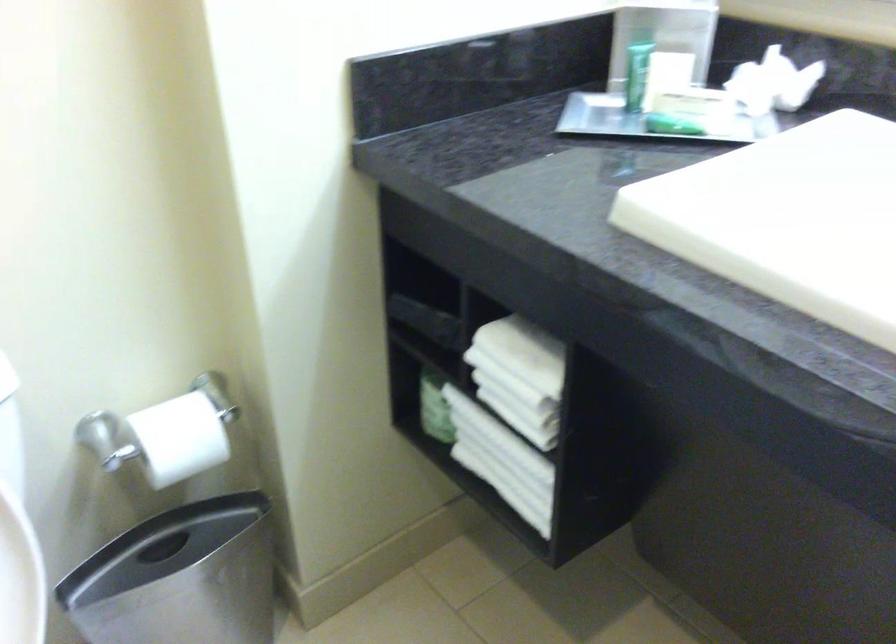
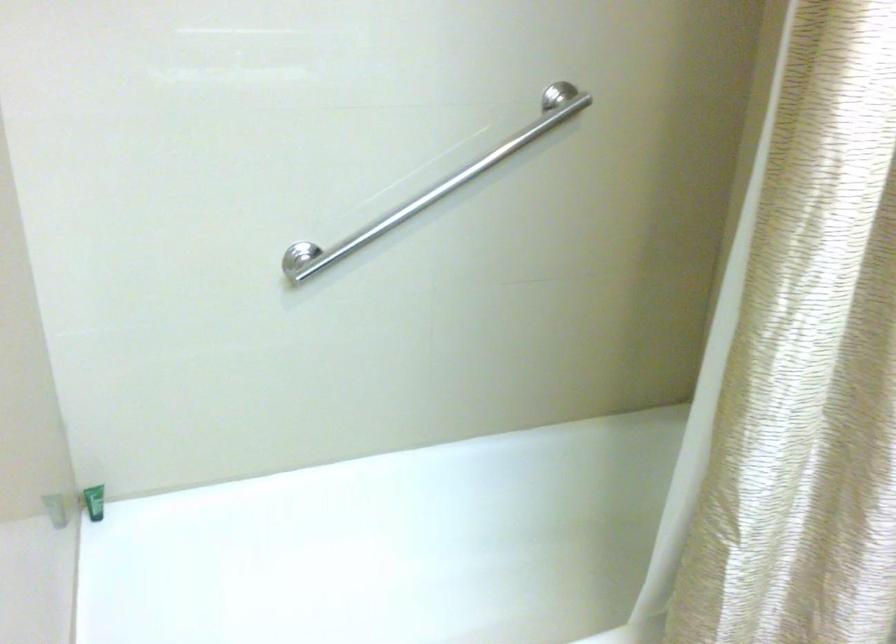
From the picture: First-person continuous shooting, in which direction is the camera rotating?

The camera rotated toward left-down.